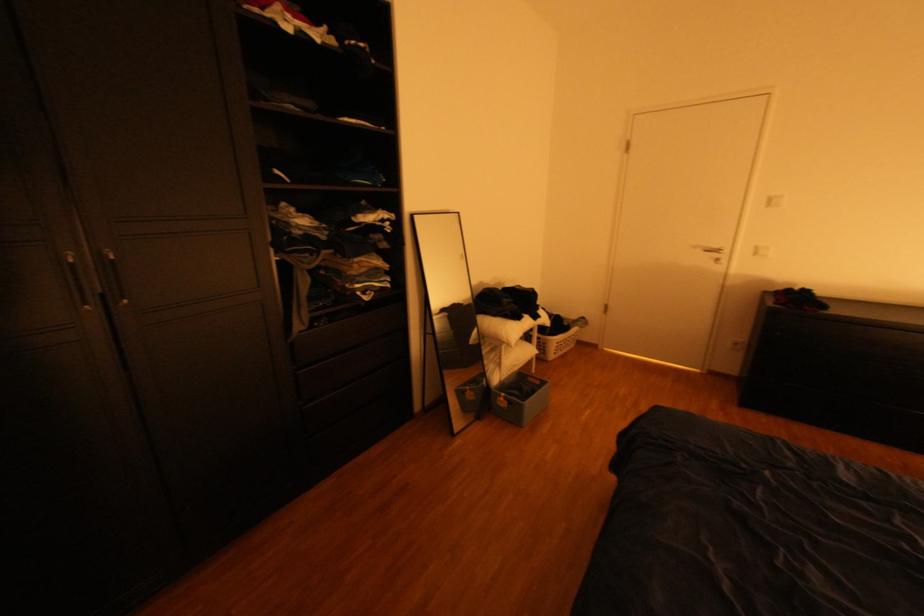
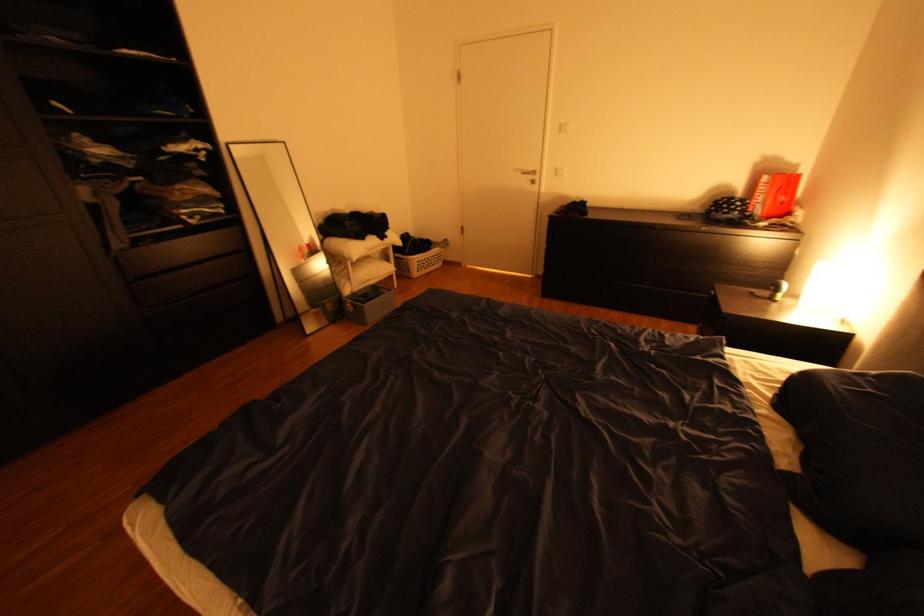
In the second image, find the point that corresponds to [702,246] in the first image.

(526, 171)